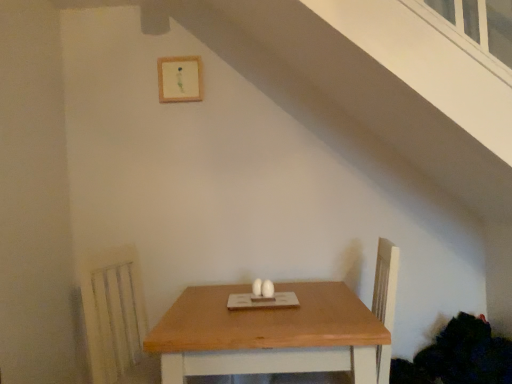
Image resolution: width=512 pixels, height=384 pixels. I want to click on wooden frame at upper center, so click(x=180, y=79).

Describe the element at coordinates (180, 79) in the screenshot. The width and height of the screenshot is (512, 384). I see `wooden frame at upper center` at that location.

What do you see at coordinates (270, 335) in the screenshot? I see `natural wood table at center` at bounding box center [270, 335].

Looking at this image, measure the distance between point [151,346] and camera.

Point [151,346] and camera are 4.65 feet apart from each other.

Identify the location of natural wood table at center. (270, 335).

Image resolution: width=512 pixels, height=384 pixels. I want to click on wooden frame at upper center, so click(x=180, y=79).

Based on the photo, is natural wood table at center to the right of wooden frame at upper center from the viewer's perspective?

Correct, you'll find natural wood table at center to the right of wooden frame at upper center.

Does natural wood table at center come in front of wooden frame at upper center?

Yes, natural wood table at center is in front of wooden frame at upper center.

Which is in front, point (216, 298) or point (196, 72)?

The point (216, 298) is more forward.

From the image's perspective, relative to wooden frame at upper center, is natural wood table at center above or below?

Based on their image positions, natural wood table at center is located beneath wooden frame at upper center.

From a real-world perspective, between natural wood table at center and wooden frame at upper center, who is vertically lower?

natural wood table at center, from a real-world perspective.

In terms of width, does natural wood table at center look wider or thinner when compared to wooden frame at upper center?

natural wood table at center is wider than wooden frame at upper center.

From their relative heights in the image, would you say natural wood table at center is taller or shorter than wooden frame at upper center?

natural wood table at center is taller than wooden frame at upper center.

In terms of size, does natural wood table at center appear bigger or smaller than wooden frame at upper center?

natural wood table at center is bigger than wooden frame at upper center.

Is natural wood table at center positioned beyond the bounds of wooden frame at upper center?

That's correct, natural wood table at center is outside of wooden frame at upper center.

Are natural wood table at center and wooden frame at upper center making contact?

natural wood table at center and wooden frame at upper center are not in contact.

Is natural wood table at center facing towards wooden frame at upper center?

No, natural wood table at center is not facing towards wooden frame at upper center.

What's the angular difference between natural wood table at center and wooden frame at upper center's facing directions?

There is a 92.8-degree angle between the facing directions of natural wood table at center and wooden frame at upper center.

How distant is natural wood table at center from wooden frame at upper center?

natural wood table at center and wooden frame at upper center are 1.34 meters apart.

The height and width of the screenshot is (384, 512). I want to click on table that appears below the wooden frame at upper center (from a real-world perspective), so click(x=270, y=335).

Considering the relative positions of wooden frame at upper center and natural wood table at center in the image provided, is wooden frame at upper center to the left or to the right of natural wood table at center?

From the image, it's evident that wooden frame at upper center is to the left of natural wood table at center.

Is wooden frame at upper center further to camera compared to natural wood table at center?

Yes, the depth of wooden frame at upper center is greater than that of natural wood table at center.

Is point (181, 59) behind point (161, 360)?

That is True.

From the image's perspective, would you say wooden frame at upper center is shown under natural wood table at center?

No, from the image's perspective, wooden frame at upper center is not below natural wood table at center.

From a real-world perspective, is wooden frame at upper center physically located above or below natural wood table at center?

wooden frame at upper center is above natural wood table at center.

Does wooden frame at upper center have a lesser width compared to natural wood table at center?

Indeed, wooden frame at upper center has a lesser width compared to natural wood table at center.

Considering the relative sizes of wooden frame at upper center and natural wood table at center in the image provided, is wooden frame at upper center taller than natural wood table at center?

In fact, wooden frame at upper center may be shorter than natural wood table at center.

Considering the sizes of wooden frame at upper center and natural wood table at center in the image, is wooden frame at upper center bigger or smaller than natural wood table at center?

In the image, wooden frame at upper center appears to be smaller than natural wood table at center.

Looking at this image, choose the correct answer: Is wooden frame at upper center inside natural wood table at center or outside it?

wooden frame at upper center exists outside the volume of natural wood table at center.

Is wooden frame at upper center far away from natural wood table at center?

wooden frame at upper center is far away from natural wood table at center.

Is natural wood table at center at the back of wooden frame at upper center?

No, wooden frame at upper center is not facing the opposite direction of natural wood table at center.

Can you tell me how much wooden frame at upper center and natural wood table at center differ in facing direction?

The angle between the facing direction of wooden frame at upper center and the facing direction of natural wood table at center is 92.8 degrees.

What are the coordinates of `picture frame that appears above the natural wood table at center (from the image's perspective)` in the screenshot? It's located at (180, 79).

In the image, there is a wooden frame at upper center. Where is `table below it (from the image's perspective)`? The width and height of the screenshot is (512, 384). table below it (from the image's perspective) is located at coordinates (270, 335).

I want to click on picture frame above the natural wood table at center (from the image's perspective), so click(180, 79).